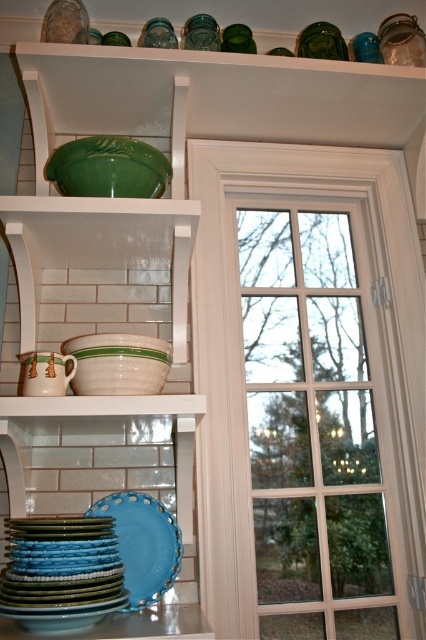
Question: Does white wood window at center have a greater width compared to blue matte platter at lower left?

Choices:
 (A) no
 (B) yes

Answer: (B)

Question: Considering the real-world distances, which object is closest to the white wood window at center?

Choices:
 (A) blue glossy platter at lower left
 (B) blue matte platter at lower left
 (C) matte white pitcher at lower left

Answer: (B)

Question: Is blue glossy platter at lower left bigger than blue matte platter at lower left?

Choices:
 (A) yes
 (B) no

Answer: (A)

Question: Which of the following is the closest to the observer?

Choices:
 (A) white wood window at center
 (B) blue matte platter at lower left
 (C) blue glossy platter at lower left

Answer: (C)

Question: Which point appears farthest from the camera in this image?

Choices:
 (A) (305, 205)
 (B) (147, 506)

Answer: (A)

Question: Is white wood window at center below blue matte platter at lower left?

Choices:
 (A) yes
 (B) no

Answer: (B)